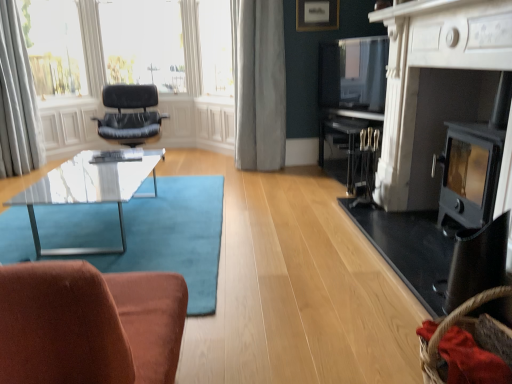
Question: Would you say teal carpet at center is a long distance from white sheer curtains at upper left?

Choices:
 (A) yes
 (B) no

Answer: (A)

Question: Can you confirm if teal carpet at center is taller than white sheer curtains at upper left?

Choices:
 (A) yes
 (B) no

Answer: (B)

Question: Does teal carpet at center have a larger size compared to white sheer curtains at upper left?

Choices:
 (A) no
 (B) yes

Answer: (B)

Question: From the image's perspective, does teal carpet at center appear lower than white sheer curtains at upper left?

Choices:
 (A) yes
 (B) no

Answer: (A)

Question: From a real-world perspective, is teal carpet at center below white sheer curtains at upper left?

Choices:
 (A) no
 (B) yes

Answer: (B)

Question: In the image, is transparent glass coffee table at lower left on the left side or the right side of black leather chair at upper left?

Choices:
 (A) right
 (B) left

Answer: (A)

Question: Considering the positions of transparent glass coffee table at lower left and black leather chair at upper left in the image, is transparent glass coffee table at lower left bigger or smaller than black leather chair at upper left?

Choices:
 (A) big
 (B) small

Answer: (B)

Question: From the image's perspective, relative to black leather chair at upper left, is transparent glass coffee table at lower left above or below?

Choices:
 (A) below
 (B) above

Answer: (A)

Question: From their relative heights in the image, would you say transparent glass coffee table at lower left is taller or shorter than black leather chair at upper left?

Choices:
 (A) short
 (B) tall

Answer: (A)

Question: From a real-world perspective, is black leather chair at upper left physically located above or below teal carpet at center?

Choices:
 (A) below
 (B) above

Answer: (B)

Question: Is black leather chair at upper left taller or shorter than teal carpet at center?

Choices:
 (A) short
 (B) tall

Answer: (B)

Question: Looking at the image, does black leather chair at upper left seem bigger or smaller compared to teal carpet at center?

Choices:
 (A) big
 (B) small

Answer: (A)

Question: Considering their positions, is black leather chair at upper left located in front of or behind teal carpet at center?

Choices:
 (A) front
 (B) behind

Answer: (B)

Question: Considering the positions of point (495, 79) and point (219, 213), is point (495, 79) closer or farther from the camera than point (219, 213)?

Choices:
 (A) farther
 (B) closer

Answer: (B)

Question: Considering the positions of matte black fireplace at right, the second fireplace positioned from the back, and teal carpet at center in the image, is matte black fireplace at right, the second fireplace positioned from the back, taller or shorter than teal carpet at center?

Choices:
 (A) tall
 (B) short

Answer: (A)